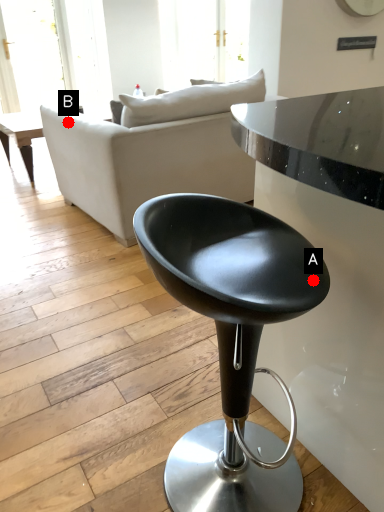
Question: Two points are circled on the image, labeled by A and B beside each circle. Which point appears farthest from the camera in this image?

Choices:
 (A) A is further
 (B) B is further

Answer: (B)